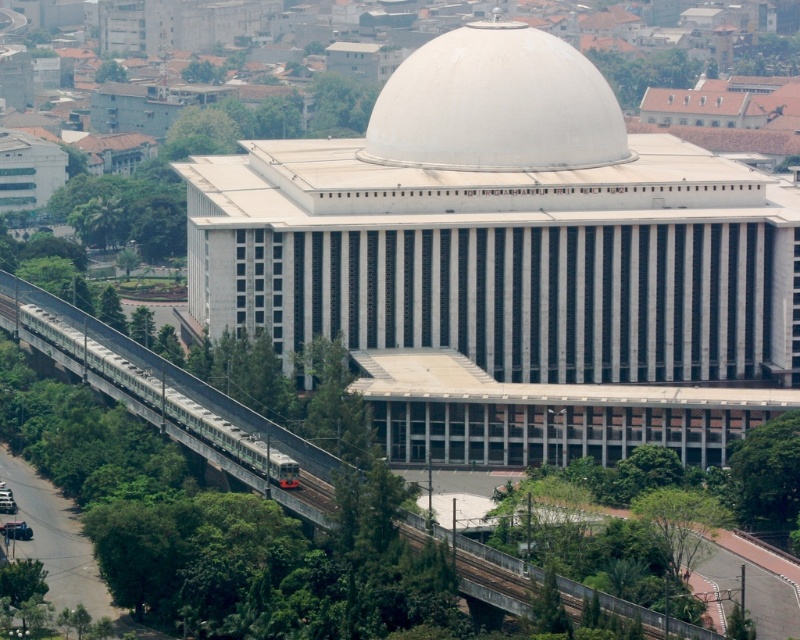
Looking at this image, can you confirm if white smooth dome at center is positioned to the right of metallic gray train track at center?

Correct, you'll find white smooth dome at center to the right of metallic gray train track at center.

Which of these two, white smooth dome at center or metallic gray train track at center, stands taller?

metallic gray train track at center

Measure the distance between point (x=540, y=58) and camera.

Point (x=540, y=58) is 1307.77 feet away from camera.

This screenshot has height=640, width=800. I want to click on white smooth dome at center, so click(496, 106).